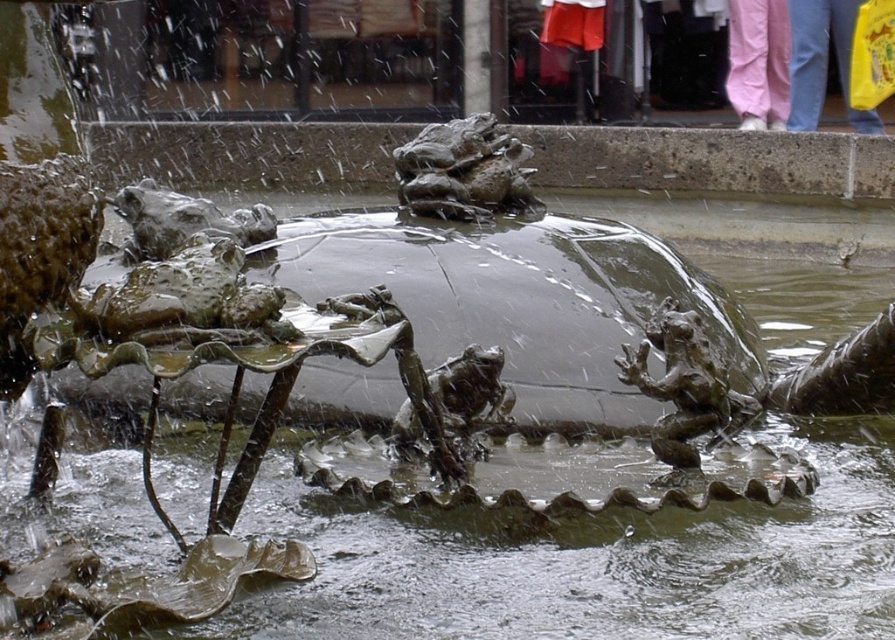
You are standing in front of the fountain sculpture and want to touch both frogs. Which frog should you reach for first, the bronze textured frog at center or the bronze textured frog at upper center?

You should reach for the bronze textured frog at center first because it is closer to you than the bronze textured frog at upper center.

You are standing in front of the fountain sculpture and want to take a photo of both the bronze textured frog at center and the bronze textured frog at upper center. Which frog is positioned lower in the frame?

The bronze textured frog at center is positioned lower in the frame than the bronze textured frog at upper center.